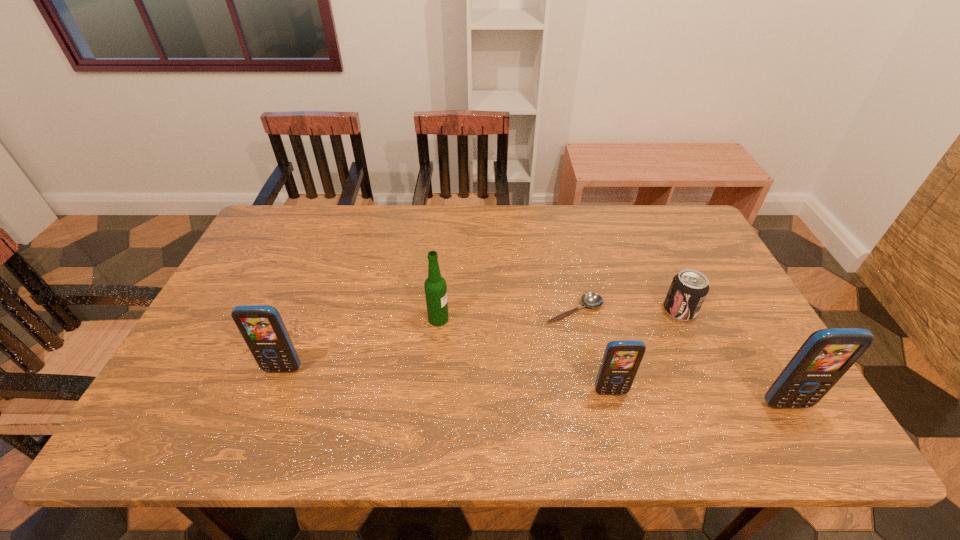
Identify the location of the second shortest cellular telephone. This screenshot has width=960, height=540. (262, 328).

Locate an element on the screen. This screenshot has width=960, height=540. the leftmost cellular telephone is located at coordinates (262, 328).

Locate an element on the screen. the second cellular telephone from left to right is located at coordinates click(621, 360).

Where is `the third shortest object`? This screenshot has height=540, width=960. the third shortest object is located at coordinates (621, 360).

Identify the location of the rightmost object. This screenshot has height=540, width=960. (827, 354).

Identify the location of the shortest object. (592, 300).

The width and height of the screenshot is (960, 540). In order to click on beer bottle in this screenshot , I will do `click(435, 286)`.

In order to click on the fifth object from left to right in this screenshot , I will do `click(689, 288)`.

The image size is (960, 540). Find the location of `soda can`. soda can is located at coordinates (689, 288).

You are a GUI agent. You are given a task and a screenshot of the screen. Output one action in this format:
    pyautogui.click(x=<x>, y=<y>)
    Task: Click on the free space located on the back of the shortest object
    This screenshot has width=960, height=540.
    Given the screenshot: What is the action you would take?
    pyautogui.click(x=564, y=266)